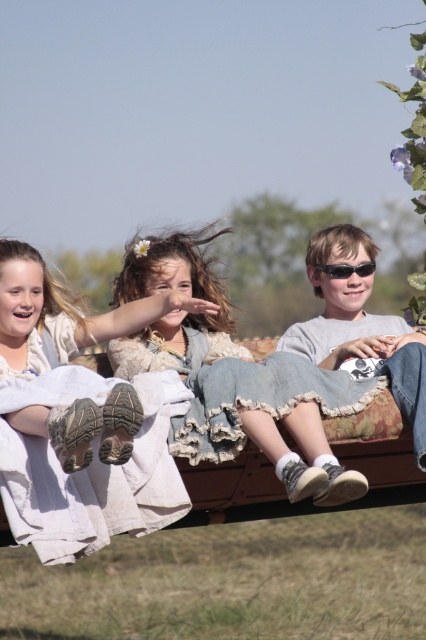
You are a photographer trying to capture a photo of the three children sitting on the wooden bench. You notice the denim skirt at center and denim jeans at center. Which clothing item has a wider width?

The denim jeans at center has a wider width than the denim skirt at center.

You are a photographer trying to capture a candid shot of the denim skirt at center and denim jeans at center. Given that your camera has a maximum focus range of 30 inches, will you be able to focus on both subjects simultaneously?

The denim skirt at center and denim jeans at center are 34.28 inches apart, which exceeds the camera maximum focus range of 30 inches. Therefore, you cannot focus on both subjects simultaneously.

What is located at the point marked as (232, 376) in the image?

The point marked as (232, 376) is where the denim skirt at center is located.